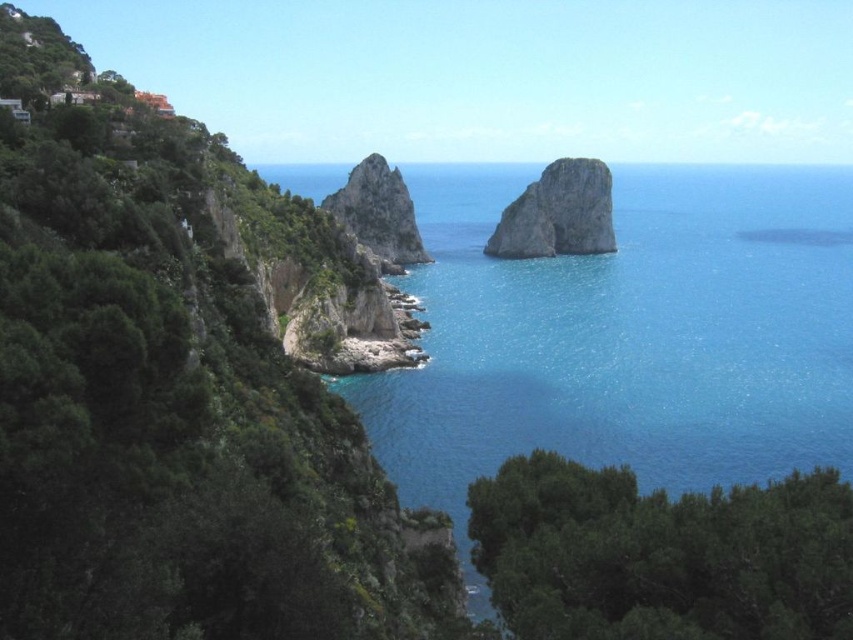
Question: Which of the following is the farthest from the observer?

Choices:
 (A) green leafy hillside at left
 (B) blue clear water at center

Answer: (B)

Question: Does green leafy hillside at left appear on the right side of rough stone rock at center?

Choices:
 (A) no
 (B) yes

Answer: (A)

Question: Does green leafy hillside at left come in front of rough stone rock at center?

Choices:
 (A) yes
 (B) no

Answer: (A)

Question: Is the position of blue clear water at center less distant than that of rough stone rock at center?

Choices:
 (A) no
 (B) yes

Answer: (B)

Question: Among these objects, which one is nearest to the camera?

Choices:
 (A) green leafy hillside at left
 (B) blue clear water at center

Answer: (A)

Question: Which point is farther to the camera?

Choices:
 (A) blue clear water at center
 (B) green leafy hillside at left

Answer: (A)